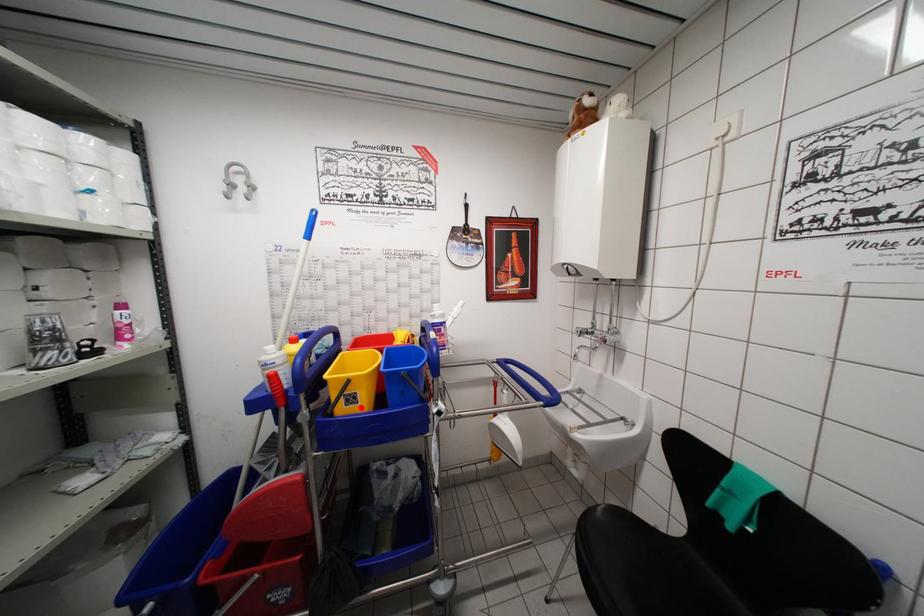
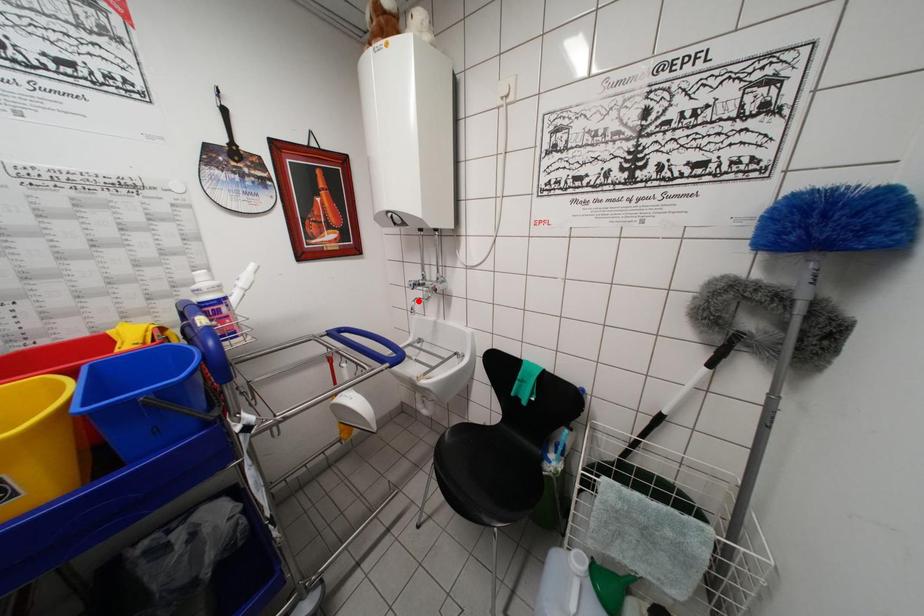
I am providing you with two images of the same scene from different viewpoints. A red point is marked on the first image and another point is marked on the second image. Do the highlighted points in image1 and image2 indicate the same real-world spot?

No